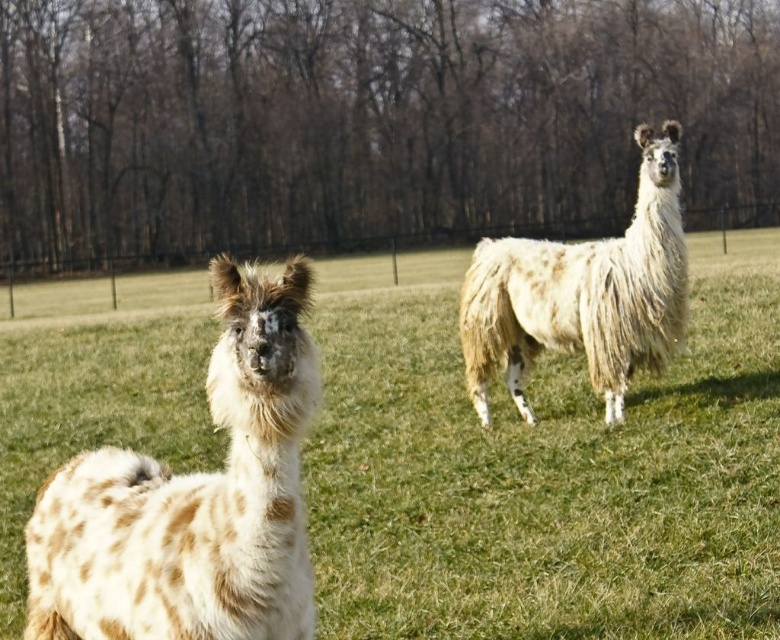
Can you confirm if spotted wool llama at center is wider than speckled wool alpaca at left?

Indeed, spotted wool llama at center has a greater width compared to speckled wool alpaca at left.

This screenshot has height=640, width=780. In order to click on spotted wool llama at center in this screenshot , I will do `click(544, 468)`.

Can you confirm if spotted wool llama at center is positioned to the left of fuzzy white alpaca at right?

Indeed, spotted wool llama at center is positioned on the left side of fuzzy white alpaca at right.

Is spotted wool llama at center positioned at the back of fuzzy white alpaca at right?

No.

Describe the element at coordinates (544, 468) in the screenshot. I see `spotted wool llama at center` at that location.

Image resolution: width=780 pixels, height=640 pixels. Find the location of `spotted wool llama at center`. spotted wool llama at center is located at coordinates [x=544, y=468].

Who is taller, speckled wool alpaca at left or fuzzy white alpaca at right?

fuzzy white alpaca at right is taller.

Does speckled wool alpaca at left have a lesser height compared to fuzzy white alpaca at right?

Yes, speckled wool alpaca at left is shorter than fuzzy white alpaca at right.

I want to click on speckled wool alpaca at left, so click(x=193, y=499).